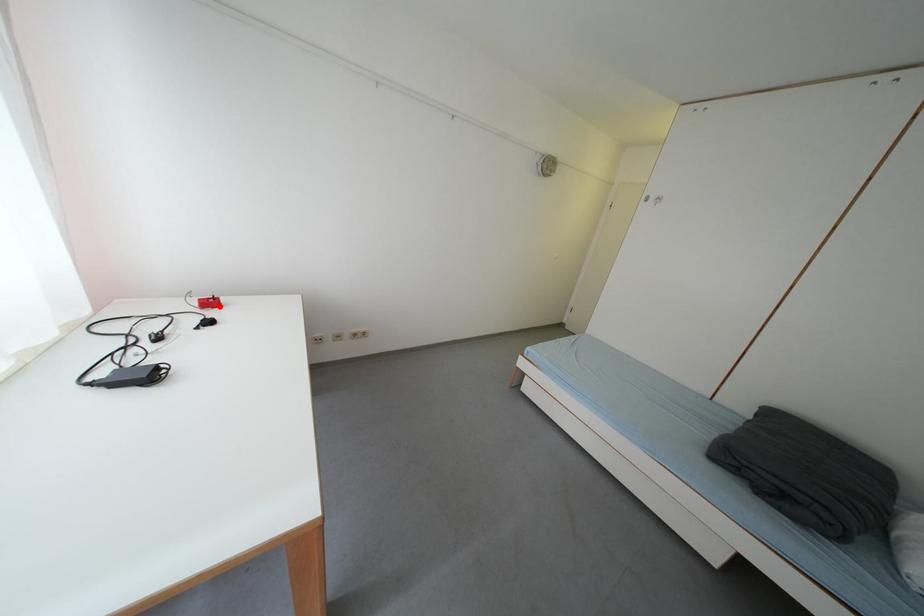
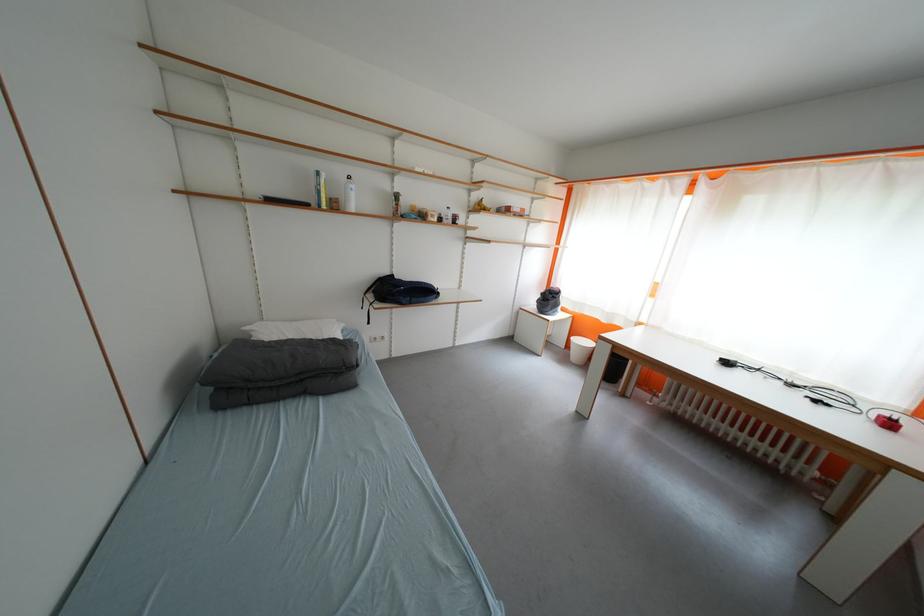
The point at the highlighted location is marked in the first image. Where is the corresponding point in the second image?

(897, 428)